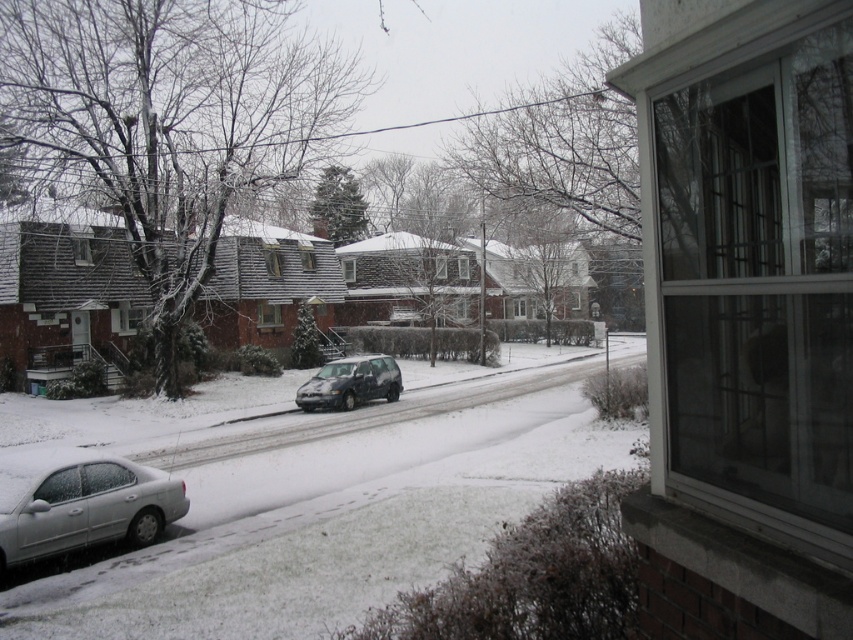
You are standing inside the house looking out the window. You see the white matte sedan at lower left and the satin black suv at center. Which car is closer to the window?

The white matte sedan at lower left is closer to the window because it is positioned to the left of the satin black suv at center, and in the scene, objects further to the left are closer to the viewer when viewed through the window.

You are a delivery person trying to determine which vehicle is closer to the front door of the house. The front door is located near the window through which you are observing. Based on the positions of the white matte sedan at lower left and the satin black suv at center, which one is closer to the front door?

The white matte sedan at lower left is closer to the front door because it is positioned closer to the viewer, who is observing from the window near the front door.

You are standing inside the house looking through the window. You see the white matte sedan at lower left and the satin black suv at center. Which vehicle is closer to you?

The white matte sedan at lower left is closer to you because it is located below the satin black suv at center, indicating it is positioned lower in the visual field which typically corresponds to being nearer.